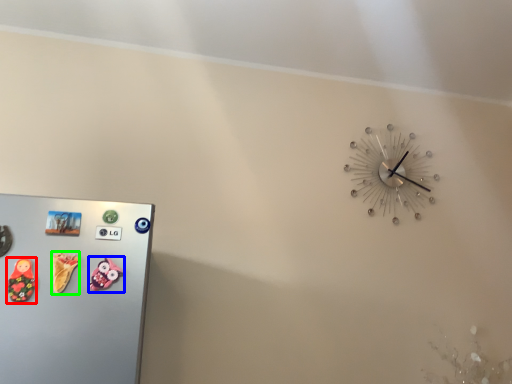
Question: Which object is the closest to the toy (highlighted by a red box)? Choose among these: toy (highlighted by a blue box) or toy (highlighted by a green box).

Choices:
 (A) toy
 (B) toy

Answer: (B)